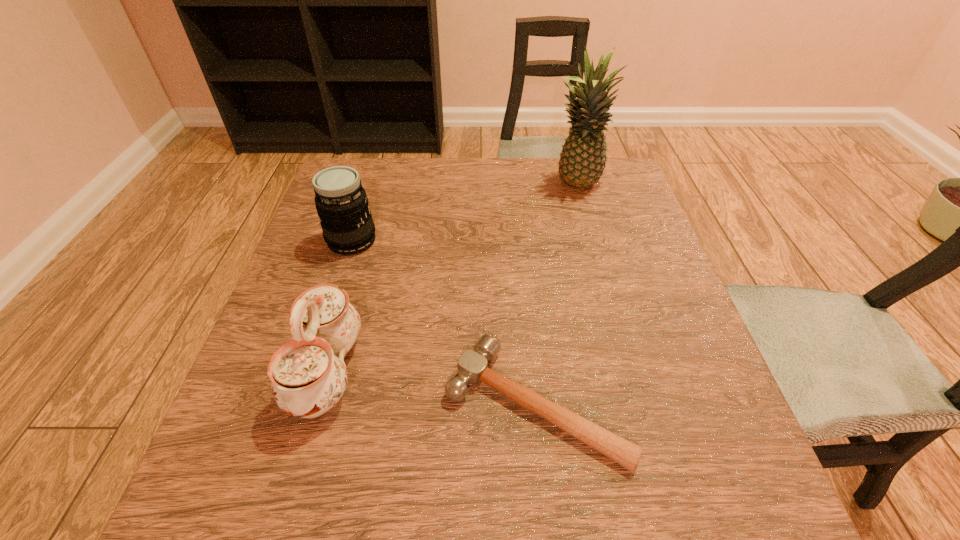
Identify the location of blank space at the near left corner. (194, 499).

Locate an element on the screen. The height and width of the screenshot is (540, 960). vacant space at the far right corner of the desktop is located at coordinates (610, 199).

You are a GUI agent. You are given a task and a screenshot of the screen. Output one action in this format:
    pyautogui.click(x=<x>, y=<y>)
    Task: Click on the free space at the near right corner of the desktop
    Image resolution: width=960 pixels, height=540 pixels.
    Given the screenshot: What is the action you would take?
    pyautogui.click(x=668, y=481)

Identify the location of empty location between the pineapple and the shortest object. Image resolution: width=960 pixels, height=540 pixels. (555, 293).

Locate an element on the screen. Image resolution: width=960 pixels, height=540 pixels. free space between the shortest object and the pineapple is located at coordinates (555, 293).

Locate an element on the screen. free space between the chinaware and the tallest object is located at coordinates (450, 278).

Find the location of a particular element. vacant region between the telephoto lens and the shortest object is located at coordinates point(444,322).

You are a GUI agent. You are given a task and a screenshot of the screen. Output one action in this format:
    pyautogui.click(x=<x>, y=<y>)
    Task: Click on the free spot between the chinaware and the tallest object
    
    Given the screenshot: What is the action you would take?
    pyautogui.click(x=450, y=278)

This screenshot has height=540, width=960. In order to click on free space that is in between the hammer and the telephoto lens in this screenshot , I will do `click(444, 322)`.

I want to click on vacant space in between the second farthest object and the hammer, so click(x=444, y=322).